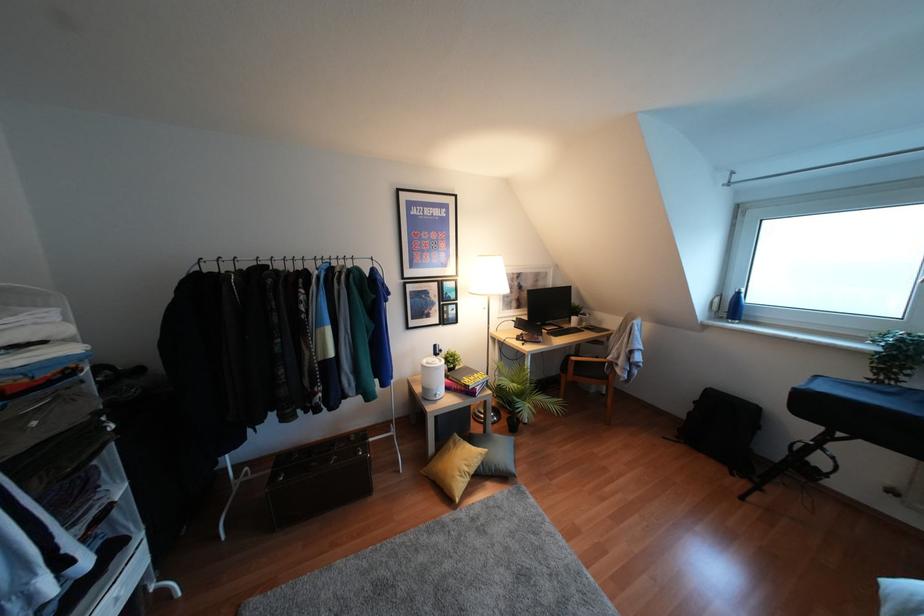
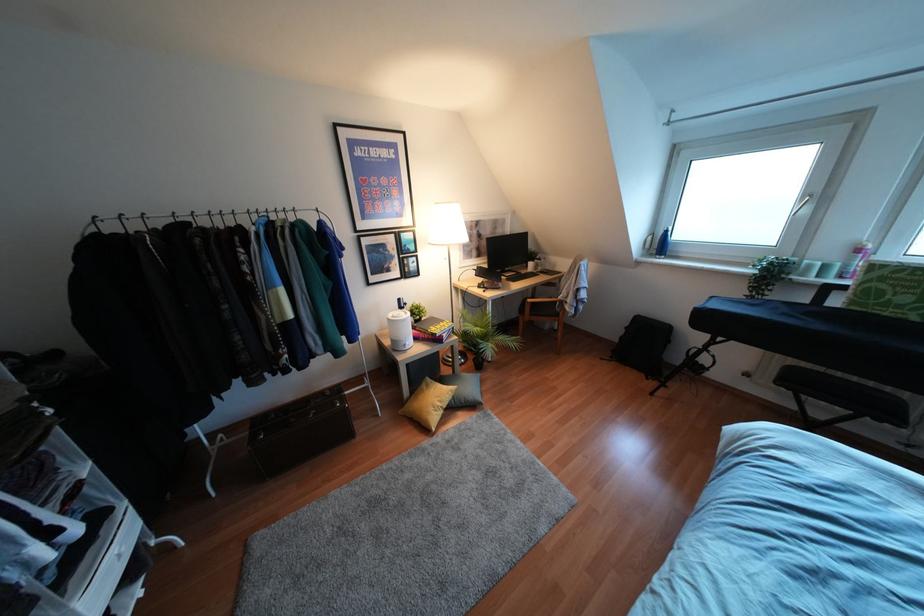
Locate, in the second image, the point that corresponds to [466,469] in the first image.

(439, 403)